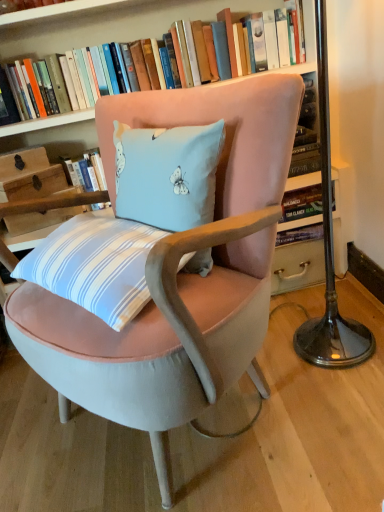
Question: Can you confirm if hardcover book at upper center is smaller than metallic base at right?

Choices:
 (A) yes
 (B) no

Answer: (A)

Question: Considering the relative sizes of hardcover book at upper center and metallic base at right in the image provided, is hardcover book at upper center wider than metallic base at right?

Choices:
 (A) yes
 (B) no

Answer: (B)

Question: From the image's perspective, is hardcover book at upper center located above metallic base at right?

Choices:
 (A) no
 (B) yes

Answer: (B)

Question: Considering the relative positions of hardcover book at upper center and metallic base at right in the image provided, is hardcover book at upper center behind metallic base at right?

Choices:
 (A) no
 (B) yes

Answer: (B)

Question: From the image's perspective, would you say hardcover book at upper center is shown under metallic base at right?

Choices:
 (A) no
 (B) yes

Answer: (A)

Question: Which is correct: hardcover book at upper center is inside metallic base at right, or outside of it?

Choices:
 (A) inside
 (B) outside

Answer: (B)

Question: Is hardcover book at upper center in front of or behind metallic base at right in the image?

Choices:
 (A) front
 (B) behind

Answer: (B)

Question: In terms of width, does hardcover book at upper center look wider or thinner when compared to metallic base at right?

Choices:
 (A) wide
 (B) thin

Answer: (B)

Question: Considering the positions of hardcover book at upper center and metallic base at right in the image, is hardcover book at upper center taller or shorter than metallic base at right?

Choices:
 (A) tall
 (B) short

Answer: (B)

Question: Considering the positions of metallic base at right and velvet pink chair at center in the image, is metallic base at right bigger or smaller than velvet pink chair at center?

Choices:
 (A) small
 (B) big

Answer: (A)

Question: In the image, is metallic base at right on the left side or the right side of velvet pink chair at center?

Choices:
 (A) left
 (B) right

Answer: (B)

Question: From a real-world perspective, is metallic base at right physically located above or below velvet pink chair at center?

Choices:
 (A) above
 (B) below

Answer: (A)

Question: From the image's perspective, is metallic base at right above or below velvet pink chair at center?

Choices:
 (A) below
 (B) above

Answer: (B)

Question: Considering the positions of point (240, 219) and point (104, 28), is point (240, 219) closer or farther from the camera than point (104, 28)?

Choices:
 (A) farther
 (B) closer

Answer: (B)

Question: From a real-world perspective, relative to hardcover book at upper center, is velvet pink chair at center vertically above or below?

Choices:
 (A) above
 (B) below

Answer: (B)